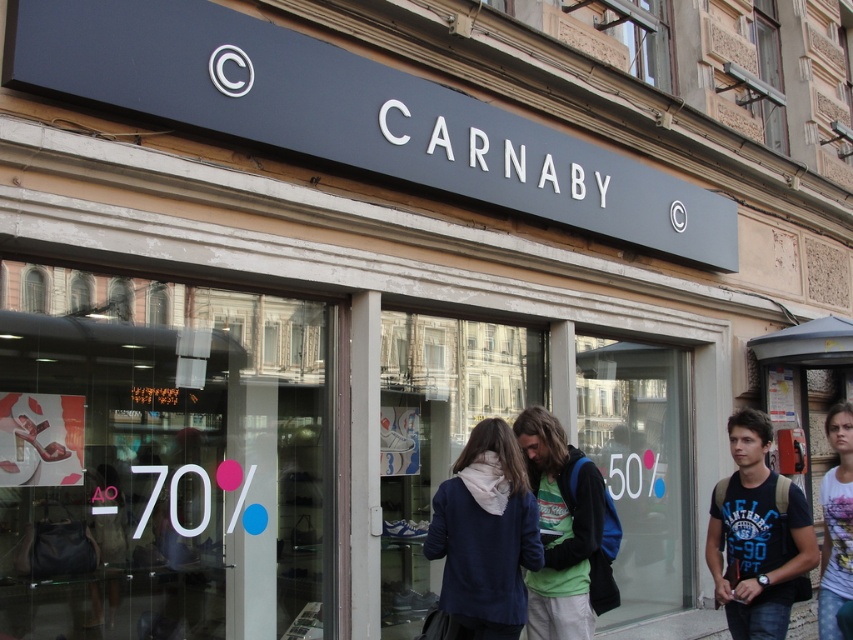
Question: Is green fleece jacket at center positioned in front of white printed t-shirt at right?

Choices:
 (A) yes
 (B) no

Answer: (A)

Question: Does transparent glass at center have a smaller size compared to white printed t-shirt at right?

Choices:
 (A) no
 (B) yes

Answer: (A)

Question: Among these objects, which one is farthest from the camera?

Choices:
 (A) transparent glass at center
 (B) blue cotton t-shirt at right

Answer: (A)

Question: Can you confirm if blue cotton t-shirt at right is positioned below green fleece jacket at center?

Choices:
 (A) yes
 (B) no

Answer: (A)

Question: Based on their relative distances, which object is nearer to the white printed t-shirt at right?

Choices:
 (A) navy blue sweater at center
 (B) green fleece jacket at center
 (C) blue cotton t-shirt at right

Answer: (C)

Question: Based on their relative distances, which object is farther from the green fleece jacket at center?

Choices:
 (A) blue cotton t-shirt at right
 (B) navy blue sweater at center
 (C) white printed t-shirt at right

Answer: (C)